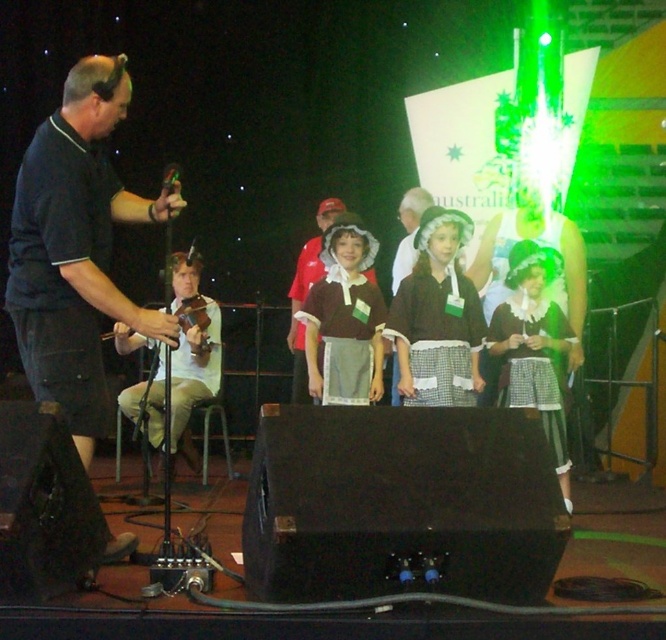
You are an event planner trying to place a new decoration. The white checkered dress at center is currently at position coordinates point 0.542, 0.802. If you want to place a decoration directly to the right of it, where should you place it?

To place a decoration directly to the right of the white checkered dress at center, you should place it at a position with an x coordinate greater than 0.542 while keeping the y coordinate around 0.802.

In the scene shown: You are a photographer positioned at the back of the stage. You need to capture a photo that includes both the matte brown dress at center and the light brown wood violin at left. Given that your camera has a fixed focal length, which object should you frame closer to the center of your shot to ensure both are visible without cropping?

Since the matte brown dress at center is narrower than the light brown wood violin at left, you should frame the matte brown dress at center closer to the center of your shot. This allows the wider violin to be accommodated within the frame while keeping the dress centrally focused.